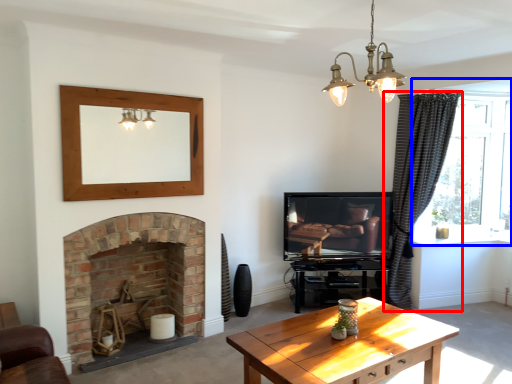
Question: Which object is further to the camera taking this photo, curtain (highlighted by a red box) or window (highlighted by a blue box)?

Choices:
 (A) curtain
 (B) window

Answer: (B)